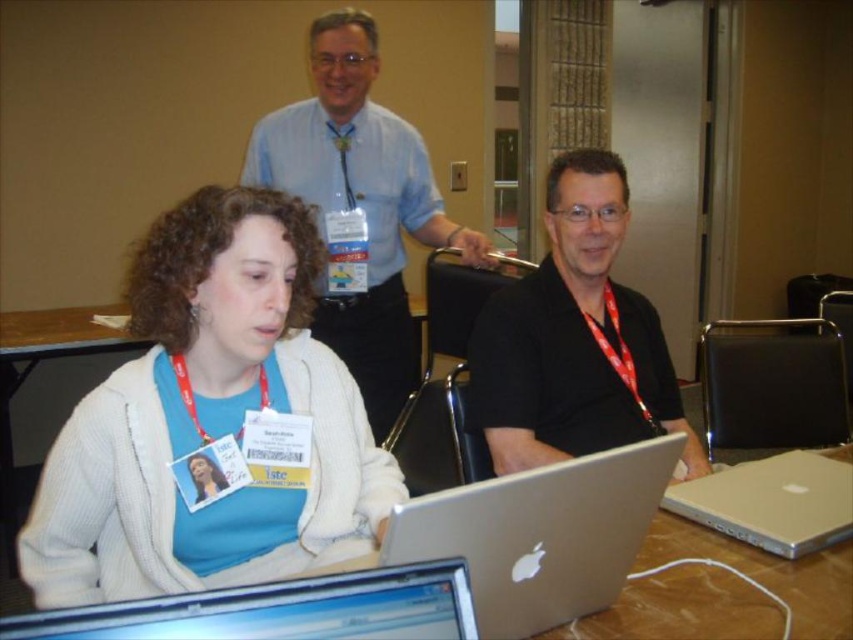
Measure the distance between black matte shirt at center and silver metallic laptop at lower right.

The distance of black matte shirt at center from silver metallic laptop at lower right is 12.53 inches.

At what (x,y) coordinates should I click in order to perform the action: click on black matte shirt at center. Please return your answer as a coordinate pair (x, y). Image resolution: width=853 pixels, height=640 pixels. Looking at the image, I should click on (575, 339).

You are a GUI agent. You are given a task and a screenshot of the screen. Output one action in this format:
    pyautogui.click(x=<x>, y=<y>)
    Task: Click on the black matte shirt at center
    Image resolution: width=853 pixels, height=640 pixels.
    Given the screenshot: What is the action you would take?
    pyautogui.click(x=575, y=339)

From the picture: Does silver metallic laptop at lower center have a greater height compared to silver metallic laptop at lower right?

In fact, silver metallic laptop at lower center may be shorter than silver metallic laptop at lower right.

Does silver metallic laptop at lower center have a lesser height compared to silver metallic laptop at lower right?

Yes, silver metallic laptop at lower center is shorter than silver metallic laptop at lower right.

You are a GUI agent. You are given a task and a screenshot of the screen. Output one action in this format:
    pyautogui.click(x=<x>, y=<y>)
    Task: Click on the silver metallic laptop at lower center
    The height and width of the screenshot is (640, 853).
    Given the screenshot: What is the action you would take?
    pyautogui.click(x=281, y=609)

This screenshot has width=853, height=640. Identify the location of white matte sweater at lower left. (207, 419).

Between point (106, 584) and point (514, 432), which one is positioned in front?

Point (106, 584) is more forward.

The height and width of the screenshot is (640, 853). I want to click on white matte sweater at lower left, so click(207, 419).